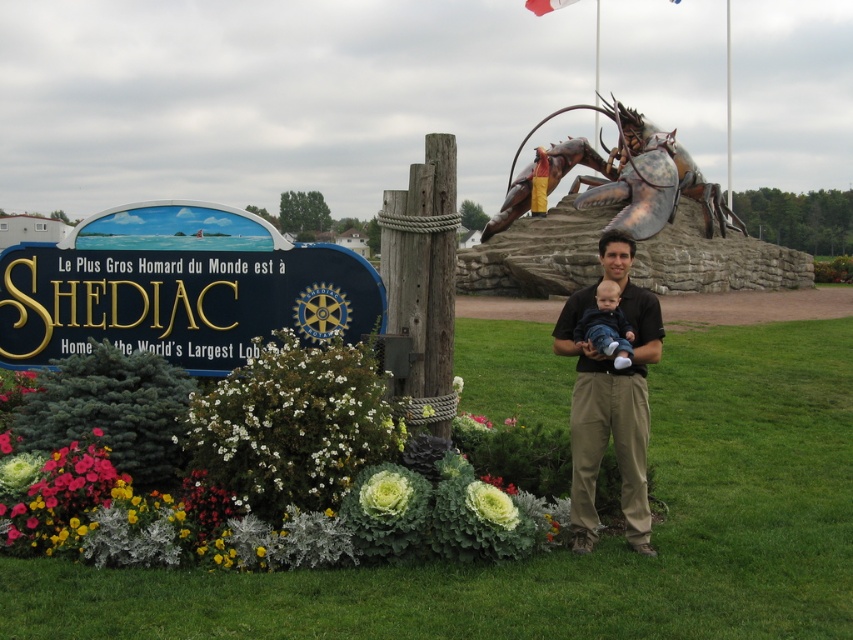
Which of these two, white fluffy bush at center or black cotton shirt at center, stands taller?

With more height is black cotton shirt at center.

Does white fluffy bush at center appear on the left side of black cotton shirt at center?

Correct, you'll find white fluffy bush at center to the left of black cotton shirt at center.

Measure the distance between white fluffy bush at center and camera.

The distance of white fluffy bush at center from camera is 4.94 meters.

Where is `white fluffy bush at center`? The width and height of the screenshot is (853, 640). white fluffy bush at center is located at coordinates (276, 481).

Between point (242, 241) and point (575, 316), which one is positioned in front?

Point (575, 316) is in front.

Is black plastic sign at left closer to the viewer compared to black cotton shirt at center?

No.

This screenshot has height=640, width=853. What do you see at coordinates (178, 289) in the screenshot? I see `black plastic sign at left` at bounding box center [178, 289].

Identify the location of black plastic sign at left. The height and width of the screenshot is (640, 853). (178, 289).

Which is above, white fluffy bush at lower center or soft white fabric baby at center?

soft white fabric baby at center

Between point (306, 396) and point (618, 348), which one is positioned in front?

Positioned in front is point (618, 348).

Identify the location of white fluffy bush at lower center. (289, 428).